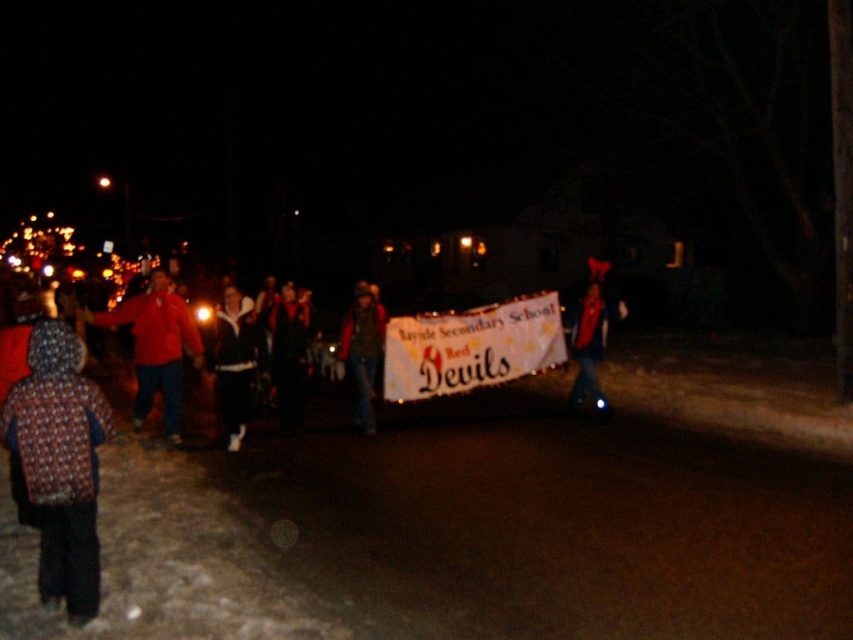
Question: Which point is closer to the camera?

Choices:
 (A) red matte jacket at left
 (B) printed fabric hood at left
 (C) black fleece jacket at center

Answer: (B)

Question: Which object is positioned closest to the printed fabric hood at left?

Choices:
 (A) red scarf at center
 (B) black fleece jacket at center

Answer: (B)

Question: Can you confirm if velvet black coat at center is positioned below red scarf at center?

Choices:
 (A) yes
 (B) no

Answer: (A)

Question: Which object is farther from the camera taking this photo?

Choices:
 (A) red scarf at center
 (B) red matte jacket at left
 (C) printed fabric hood at left
 (D) matte black jacket at center

Answer: (A)

Question: Does printed fabric hood at left appear on the right side of black fleece jacket at center?

Choices:
 (A) no
 (B) yes

Answer: (B)

Question: Is printed fabric hood at left to the right of matte black jacket at center from the viewer's perspective?

Choices:
 (A) no
 (B) yes

Answer: (A)